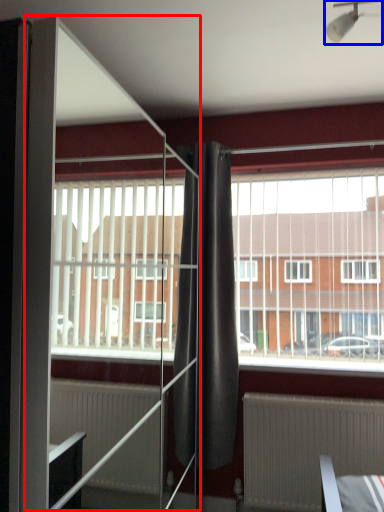
Question: Which of the following is the farthest to the observer, screen door (highlighted by a red box) or light fixture (highlighted by a blue box)?

Choices:
 (A) screen door
 (B) light fixture

Answer: (B)